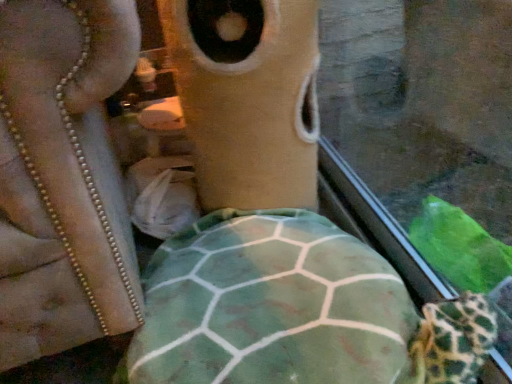
Question: From a real-world perspective, relative to fuzzy beige cat at center, is green fabric tortoise at center vertically above or below?

Choices:
 (A) above
 (B) below

Answer: (B)

Question: From the image's perspective, is green fabric tortoise at center located above or below fuzzy beige cat at center?

Choices:
 (A) below
 (B) above

Answer: (A)

Question: In terms of width, does green fabric tortoise at center look wider or thinner when compared to fuzzy beige cat at center?

Choices:
 (A) wide
 (B) thin

Answer: (A)

Question: In the image, is fuzzy beige cat at center positioned in front of or behind green fabric tortoise at center?

Choices:
 (A) behind
 (B) front

Answer: (A)

Question: Is fuzzy beige cat at center inside the boundaries of green fabric tortoise at center, or outside?

Choices:
 (A) outside
 (B) inside

Answer: (A)

Question: Visually, is fuzzy beige cat at center positioned to the left or to the right of green fabric tortoise at center?

Choices:
 (A) left
 (B) right

Answer: (B)

Question: Considering the positions of fuzzy beige cat at center and green fabric tortoise at center in the image, is fuzzy beige cat at center bigger or smaller than green fabric tortoise at center?

Choices:
 (A) big
 (B) small

Answer: (B)